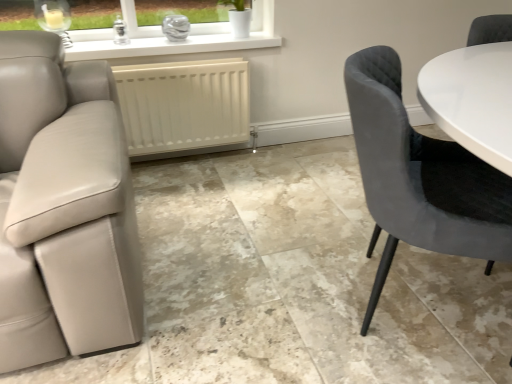
This screenshot has height=384, width=512. What are the coordinates of `blank area beneath velvet grey chair at right (from a real-world perspective)` in the screenshot? It's located at (417, 302).